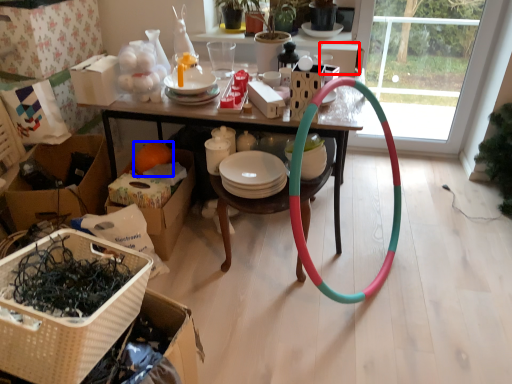
Question: Which of the following is the farthest to the observer, box (highlighted by a red box) or orange (highlighted by a blue box)?

Choices:
 (A) box
 (B) orange

Answer: (B)